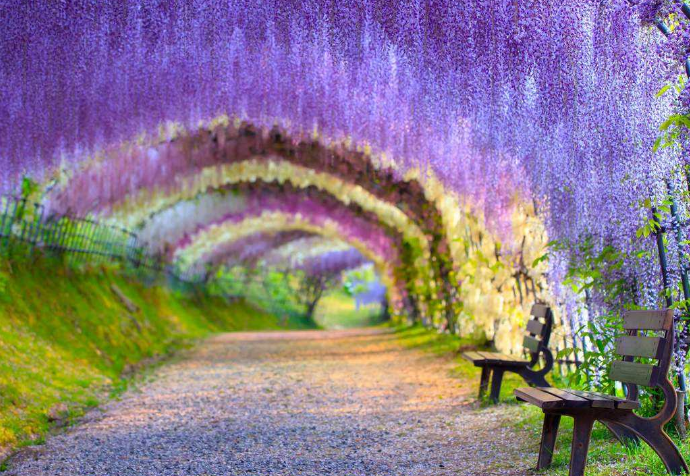
Find the location of a particular element. The width and height of the screenshot is (690, 476). pick archway is located at coordinates (373, 234).